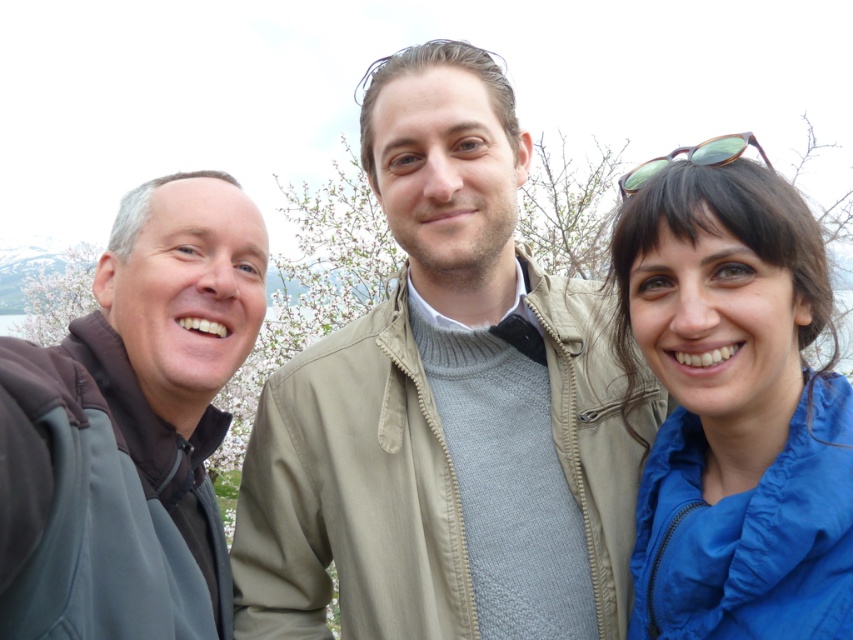
Can you confirm if white blossoms at left is wider than green acetate sunglasses at upper right?

Correct, the width of white blossoms at left exceeds that of green acetate sunglasses at upper right.

Who is more distant from viewer, (86, 307) or (729, 150)?

The point (86, 307) is more distant.

Find the location of a particular element. This screenshot has height=640, width=853. white blossoms at left is located at coordinates (57, 296).

Does dark gray fleece jacket at left appear over green acetate sunglasses at upper right?

No.

Between point (144, 500) and point (637, 172), which one is positioned in front?

Point (144, 500) is more forward.

Identify the location of dark gray fleece jacket at left. This screenshot has height=640, width=853. (131, 426).

Does blue nylon jacket at right lie behind white blossoms at left?

No.

Is blue nylon jacket at right to the right of white blossoms at left from the viewer's perspective?

Yes, blue nylon jacket at right is to the right of white blossoms at left.

Which is behind, point (775, 237) or point (36, 278)?

Point (36, 278)

Where is `blue nylon jacket at right`? This screenshot has width=853, height=640. blue nylon jacket at right is located at coordinates (734, 410).